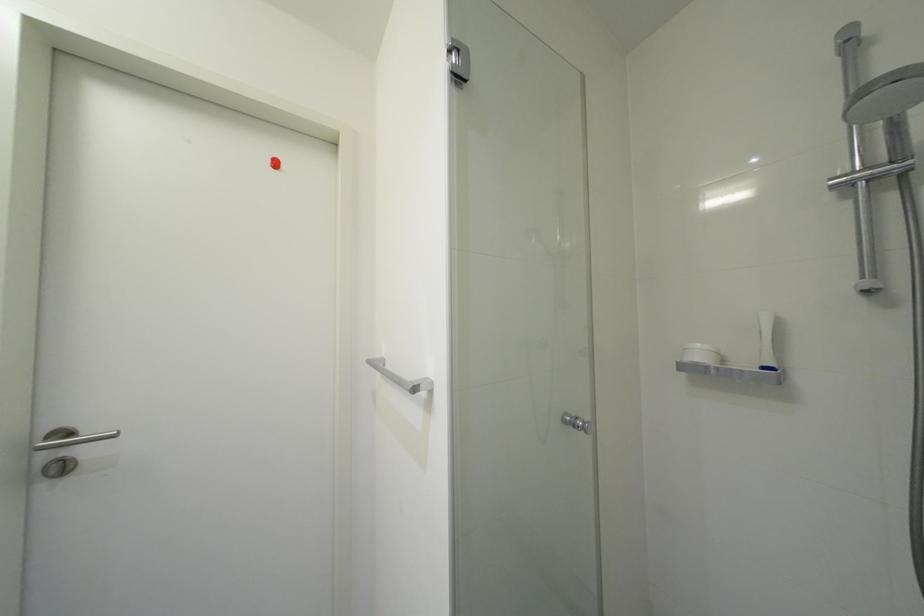
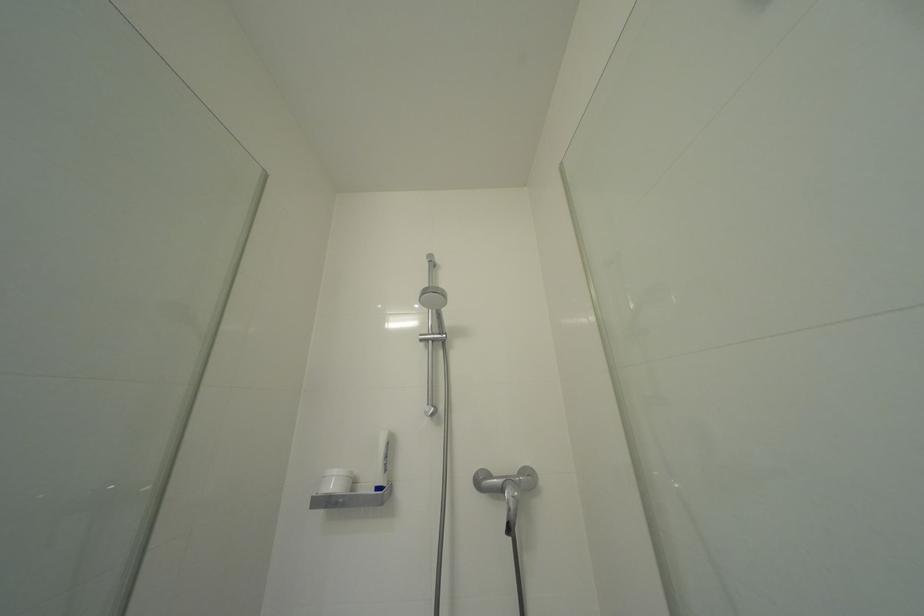
The images are taken continuously from a first-person perspective. In which direction is your viewpoint rotating?

The camera's rotation is toward right-up.